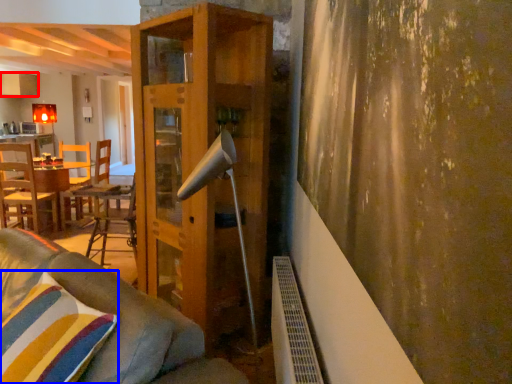
Question: Which object is closer to the camera taking this photo, cabinetry (highlighted by a red box) or pillow (highlighted by a blue box)?

Choices:
 (A) cabinetry
 (B) pillow

Answer: (B)